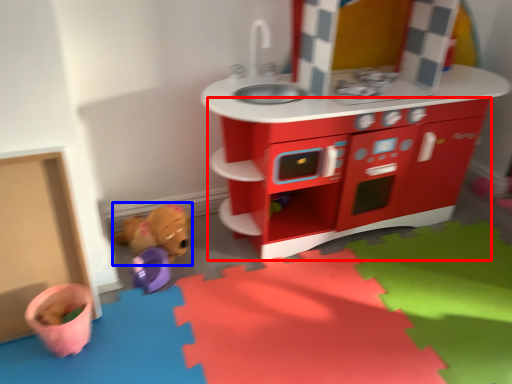
Question: Which object is further to the camera taking this photo, cabinetry (highlighted by a red box) or toy (highlighted by a blue box)?

Choices:
 (A) cabinetry
 (B) toy

Answer: (B)